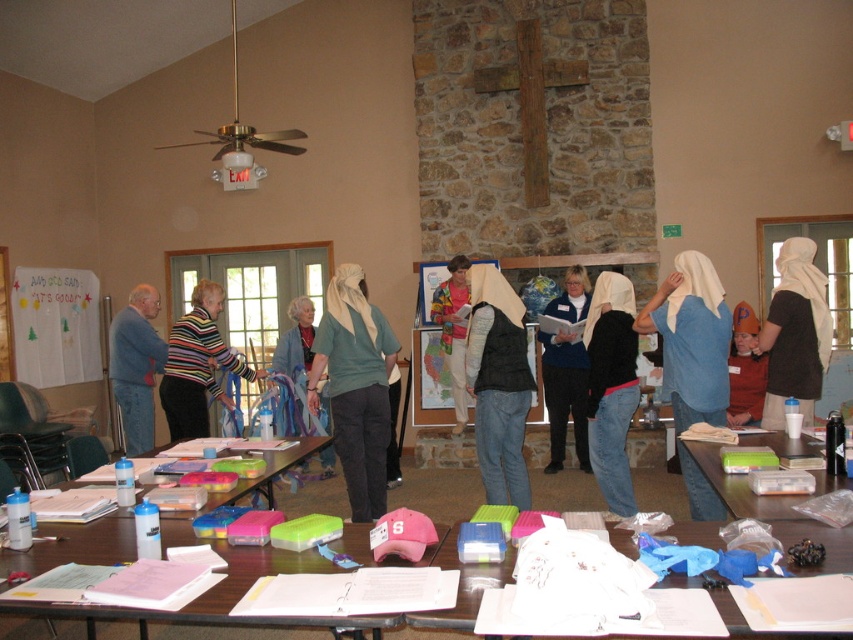
Question: Which object is farther from the camera taking this photo?

Choices:
 (A) blue fleece vest at center
 (B) black matte vest at center
 (C) orange felt costume at center
 (D) translucent plastic gloves at lower center

Answer: (A)

Question: Based on their relative distances, which object is farther from the clear plastic container at lower right?

Choices:
 (A) translucent plastic containers at center
 (B) beige cotton hijab at center
 (C) translucent plastic gloves at lower center

Answer: (A)

Question: Which of the following is the closest to the observer?

Choices:
 (A) (701, 289)
 (B) (592, 376)
 (C) (137, 308)
 (D) (703, 444)

Answer: (D)

Question: Is beige cotton hijab at center to the left of blue denim jacket at left from the viewer's perspective?

Choices:
 (A) yes
 (B) no

Answer: (B)

Question: Can you confirm if translucent plastic gloves at lower center is smaller than striped sweater at center?

Choices:
 (A) no
 (B) yes

Answer: (B)

Question: Is beige fabric headscarf at center further to the viewer compared to floral scarf at center?

Choices:
 (A) yes
 (B) no

Answer: (B)